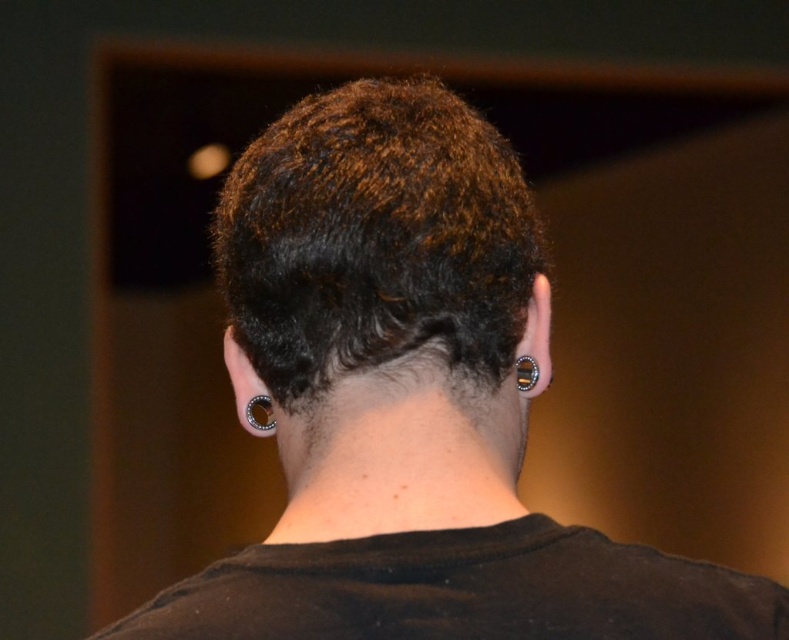
Between dark brown curly hair at center and black cotton t-shirt at center, which one appears on the left side from the viewer's perspective?

dark brown curly hair at center is more to the left.

Describe the element at coordinates (376, 240) in the screenshot. Image resolution: width=789 pixels, height=640 pixels. I see `dark brown curly hair at center` at that location.

Find the location of a particular element. The height and width of the screenshot is (640, 789). dark brown curly hair at center is located at coordinates (376, 240).

Is dark brown curly hair at center to the right of satin silver ring at ear from the viewer's perspective?

Indeed, dark brown curly hair at center is positioned on the right side of satin silver ring at ear.

Can you confirm if dark brown curly hair at center is positioned below satin silver ring at ear?

Actually, dark brown curly hair at center is above satin silver ring at ear.

The image size is (789, 640). What do you see at coordinates (376, 240) in the screenshot?
I see `dark brown curly hair at center` at bounding box center [376, 240].

The height and width of the screenshot is (640, 789). What are the coordinates of `dark brown curly hair at center` in the screenshot? It's located at (376, 240).

Can you confirm if dark brown curly hair at center is smaller than black metallic ring at ear?

Actually, dark brown curly hair at center might be larger than black metallic ring at ear.

Which is more to the right, dark brown curly hair at center or black metallic ring at ear?

black metallic ring at ear is more to the right.

Is point (279, 278) behind point (522, 378)?

No, (279, 278) is in front of (522, 378).

What are the coordinates of `dark brown curly hair at center` in the screenshot? It's located at [x=376, y=240].